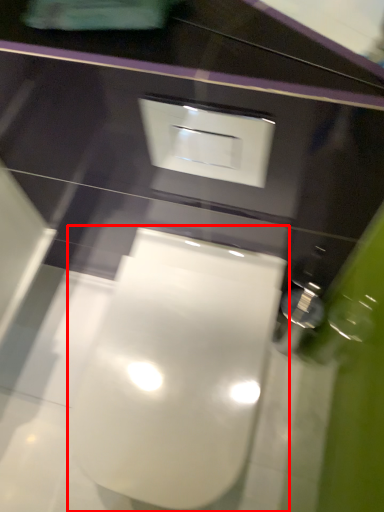
Question: In this image, where is toilet (annotated by the red box) located relative to square?

Choices:
 (A) left
 (B) right

Answer: (A)